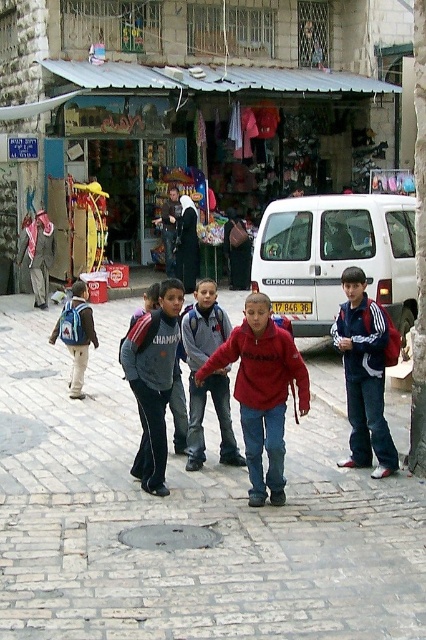
You are a delivery person who needs to deliver a package to the shop behind the children. You notice the gray fleece jacket at center and the matte blue backpack at left. Which item is closer to the shop?

The gray fleece jacket at center is located below matte blue backpack at left, so the gray fleece jacket at center is closer to the shop.

You are a delivery person trying to deliver a package to the shop with the metallic silver awning at center. You notice the red matte sweatshirt at center is blocking the entrance. Can you walk under the awning without bending down?

The metallic silver awning at center is taller than the red matte sweatshirt at center, so yes, you can walk under the metallic silver awning at center without bending down since the awning is higher than the sweatshirt.

You are a parent looking for your child who is wearing a gray fleece jacket at center and carrying a matte blue backpack at left. Based on the scene description, which item is positioned closer to the right side of the image?

The gray fleece jacket at center is positioned to the right of the matte blue backpack at left, so the gray fleece jacket at center is closer to the right side of the image.